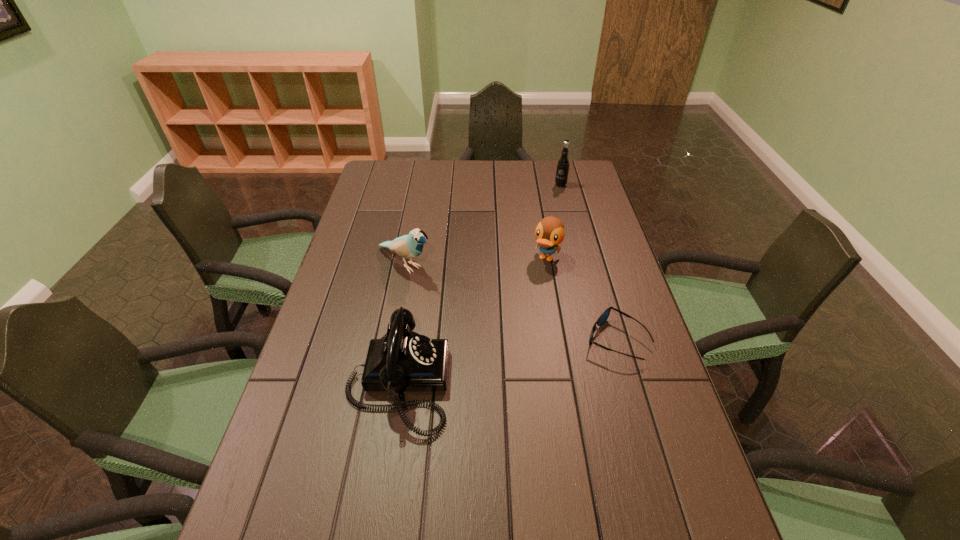
Point out which object is positioned as the third nearest to the duck. Please provide its 2D coordinates. Your answer should be formatted as a tuple, i.e. [(x, y)], where the tuple contains the x and y coordinates of a point satisfying the conditions above.

[(402, 360)]

Find the location of a particular element. The height and width of the screenshot is (540, 960). free space that satisfies the following two spatial constraints: 1. on the front side of the farthest object; 2. at the front of the shortest object showing the lenses is located at coordinates (600, 340).

At what (x,y) coordinates should I click in order to perform the action: click on free location that satisfies the following two spatial constraints: 1. on the front side of the shortest object; 2. at the front of the bird showing the lenses. Please return your answer as a coordinate pair (x, y). This screenshot has width=960, height=540. Looking at the image, I should click on (391, 340).

Identify the location of vacant region that satisfies the following two spatial constraints: 1. on the front side of the bird; 2. on the dial of the telephone. The image size is (960, 540). (382, 382).